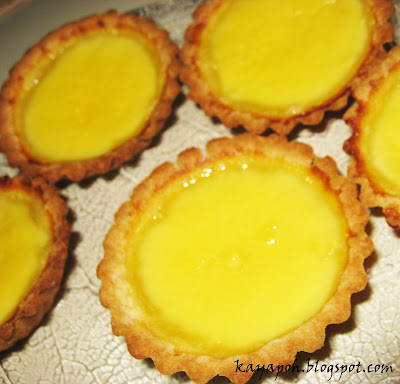
Find the location of a particular element. Image resolution: width=400 pixels, height=384 pixels. tray is located at coordinates (372, 337), (85, 355), (182, 130).